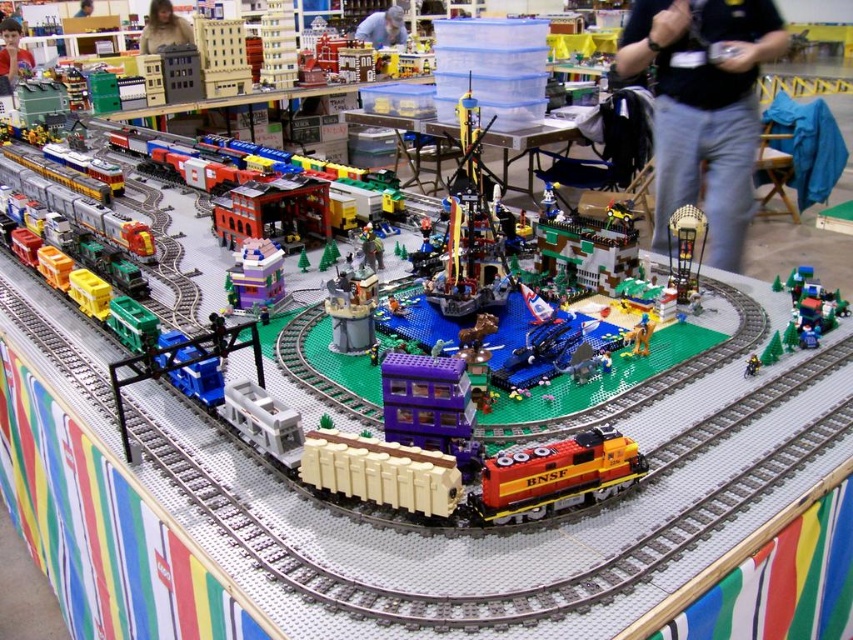
Is point (155, 3) behind point (375, 26)?

No, (155, 3) is closer to viewer.

Who is taller, matte beige jacket at upper left or blue fabric shirt at center?

matte beige jacket at upper left is taller.

Which is behind, point (167, 36) or point (390, 20)?

Point (390, 20)

The image size is (853, 640). I want to click on matte beige jacket at upper left, so click(x=163, y=28).

Between point (236, 292) and point (177, 29), which one is positioned behind?

Positioned behind is point (177, 29).

Between point (235, 275) and point (189, 44), which one is positioned behind?

The point (189, 44) is more distant.

This screenshot has width=853, height=640. I want to click on purple plastic building at center, so click(254, 275).

From the picture: Who is positioned more to the left, smooth gray tower at center or matte beige jacket at upper left?

matte beige jacket at upper left is more to the left.

You are a GUI agent. You are given a task and a screenshot of the screen. Output one action in this format:
    pyautogui.click(x=<x>, y=<y>)
    Task: Click on the smooth gray tower at center
    
    Given the screenshot: What is the action you would take?
    pyautogui.click(x=351, y=310)

The width and height of the screenshot is (853, 640). Identify the location of smooth gray tower at center. (351, 310).

Image resolution: width=853 pixels, height=640 pixels. Identify the location of smooth gray tower at center. (351, 310).